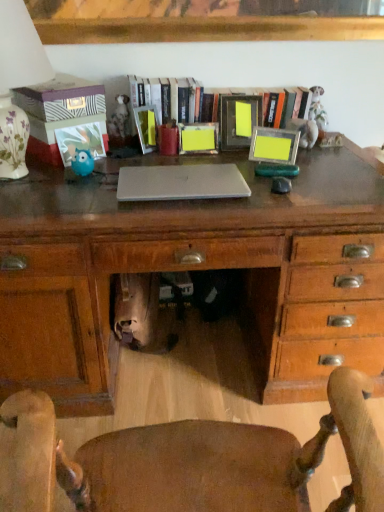
Question: Does wooden chair at center have a lesser height compared to wooden frame at center?

Choices:
 (A) yes
 (B) no

Answer: (B)

Question: From the image's perspective, is wooden chair at center located above wooden frame at center?

Choices:
 (A) yes
 (B) no

Answer: (B)

Question: Is wooden chair at center at the left side of wooden frame at center?

Choices:
 (A) no
 (B) yes

Answer: (B)

Question: Could you tell me if wooden chair at center is turned towards wooden frame at center?

Choices:
 (A) no
 (B) yes

Answer: (B)

Question: From a real-world perspective, is wooden chair at center positioned under wooden frame at center based on gravity?

Choices:
 (A) no
 (B) yes

Answer: (B)

Question: Is matte plastic picture frame at upper center, positioned as the fourth picture frame in right-to-left order, to the left or to the right of matte blue owl at left, which is the 1th picture frame from left to right, in the image?

Choices:
 (A) right
 (B) left

Answer: (A)

Question: Is matte plastic picture frame at upper center, positioned as the fourth picture frame in right-to-left order, inside the boundaries of matte blue owl at left, marked as the 5th picture frame in a right-to-left arrangement, or outside?

Choices:
 (A) inside
 (B) outside

Answer: (B)

Question: From the image's perspective, is matte plastic picture frame at upper center, arranged as the second picture frame when viewed from the left, positioned above or below matte blue owl at left, marked as the 5th picture frame in a right-to-left arrangement?

Choices:
 (A) below
 (B) above

Answer: (B)

Question: Is matte plastic picture frame at upper center, positioned as the fourth picture frame in right-to-left order, wider or thinner than matte blue owl at left, which is the 1th picture frame from left to right?

Choices:
 (A) wide
 (B) thin

Answer: (A)

Question: Relative to yellow matte picture frame at center, which appears as the third picture frame when viewed from the right, is matte blue owl at left, marked as the 2th toy in a back-to-front arrangement, in front or behind?

Choices:
 (A) front
 (B) behind

Answer: (A)

Question: From a real-world perspective, is matte blue owl at left, marked as the 2th toy in a back-to-front arrangement, positioned above or below yellow matte picture frame at center, acting as the third picture frame starting from the left?

Choices:
 (A) above
 (B) below

Answer: (B)

Question: In terms of size, does matte blue owl at left, positioned as the 1th toy in front-to-back order, appear bigger or smaller than yellow matte picture frame at center, acting as the third picture frame starting from the left?

Choices:
 (A) big
 (B) small

Answer: (B)

Question: Is point (84, 165) closer or farther from the camera than point (216, 123)?

Choices:
 (A) closer
 (B) farther

Answer: (A)

Question: From a real-world perspective, relative to wooden chair at center, is matte blue owl at left, marked as the 5th picture frame in a right-to-left arrangement, vertically above or below?

Choices:
 (A) above
 (B) below

Answer: (A)

Question: Is matte blue owl at left, marked as the 5th picture frame in a right-to-left arrangement, in front of or behind wooden chair at center in the image?

Choices:
 (A) front
 (B) behind

Answer: (B)